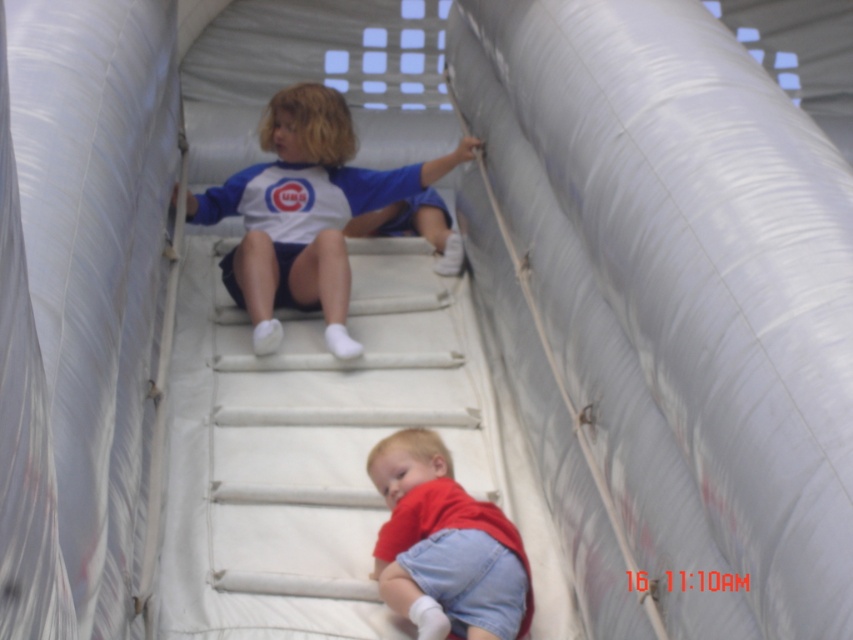
Question: Is blue jersey at center in front of red cotton shirt at lower center?

Choices:
 (A) no
 (B) yes

Answer: (A)

Question: Can you confirm if blue jersey at center is positioned to the right of red cotton shirt at lower center?

Choices:
 (A) yes
 (B) no

Answer: (B)

Question: Can you confirm if blue jersey at center is positioned below red cotton shirt at lower center?

Choices:
 (A) no
 (B) yes

Answer: (A)

Question: Which point is farther to the camera?

Choices:
 (A) (247, 294)
 (B) (450, 465)

Answer: (A)

Question: Which of the following is the closest to the observer?

Choices:
 (A) red cotton shirt at lower center
 (B) blue jersey at center

Answer: (A)